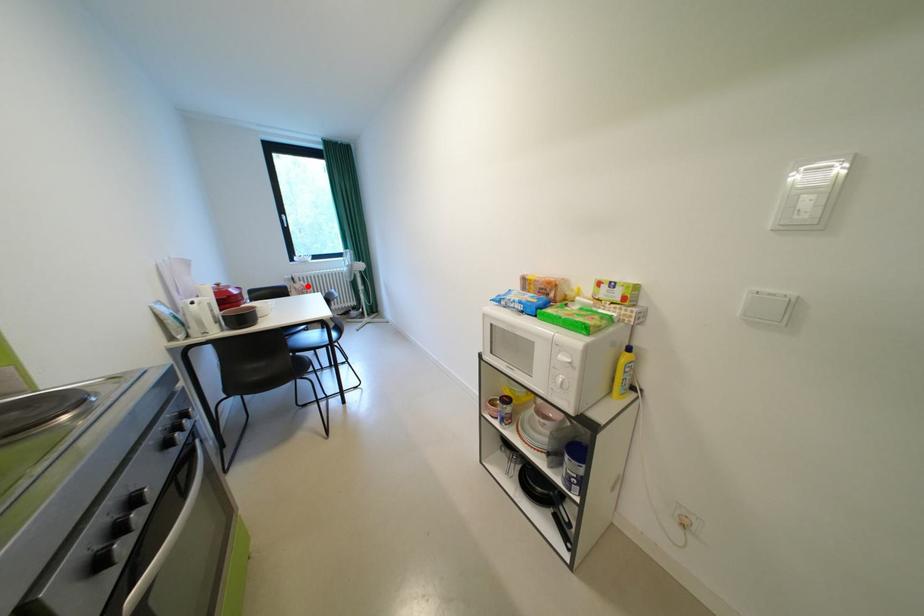
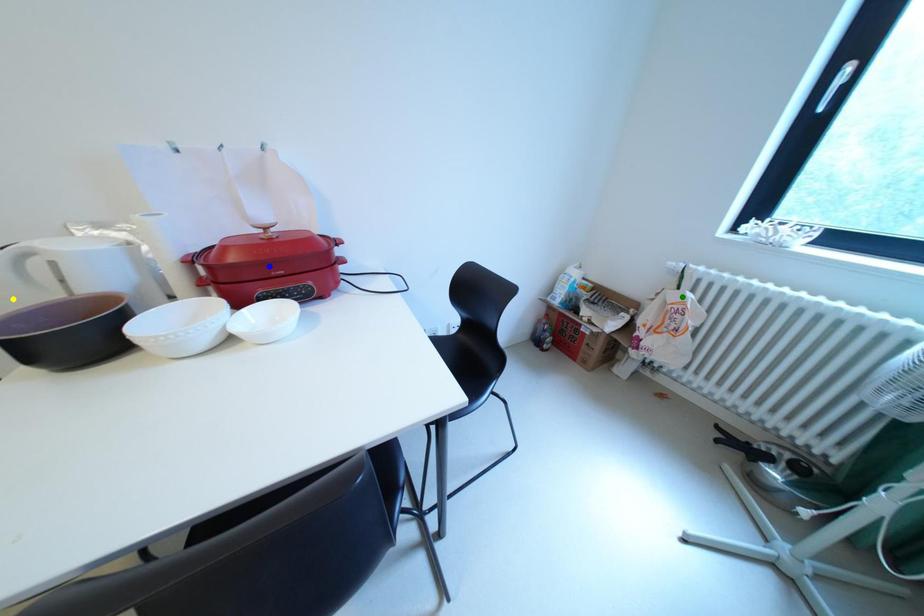
Question: I am providing you with two images of the same scene from different viewpoints. A red point is marked on the first image. You are given multiple points on the second image. Which mark in image 2 goes with the point in image 1?

Choices:
 (A) yellow point
 (B) green point
 (C) blue point

Answer: (B)